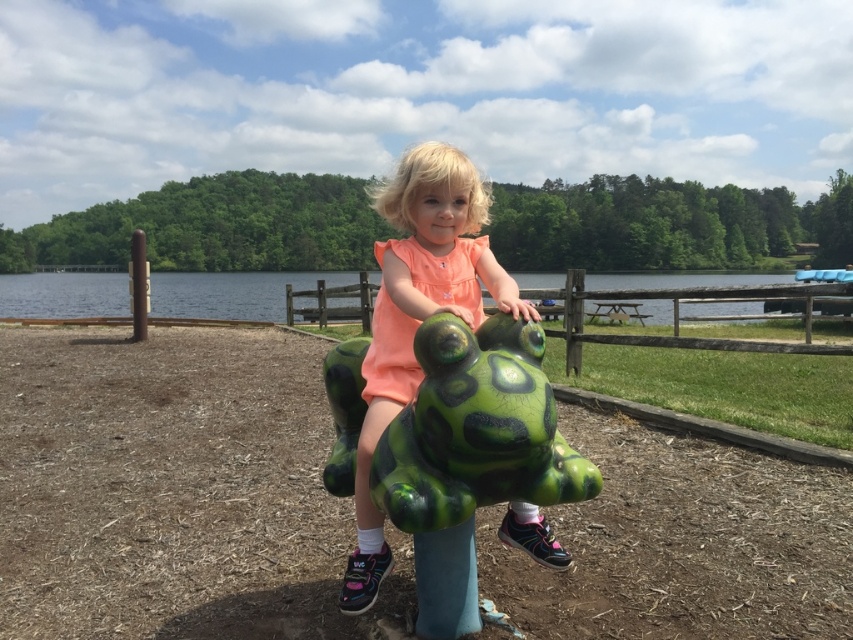
Question: Is matte green plastic frog at center to the right of green plastic water at center from the viewer's perspective?

Choices:
 (A) yes
 (B) no

Answer: (A)

Question: Which point is closer to the camera?

Choices:
 (A) matte green plastic frog at center
 (B) green plastic water at center

Answer: (A)

Question: Which point appears farthest from the camera in this image?

Choices:
 (A) (172, 273)
 (B) (556, 552)

Answer: (A)

Question: In this image, where is matte green plastic frog at center located relative to green plastic water at center?

Choices:
 (A) right
 (B) left

Answer: (A)

Question: Can you confirm if matte green plastic frog at center is positioned to the left of green plastic water at center?

Choices:
 (A) no
 (B) yes

Answer: (A)